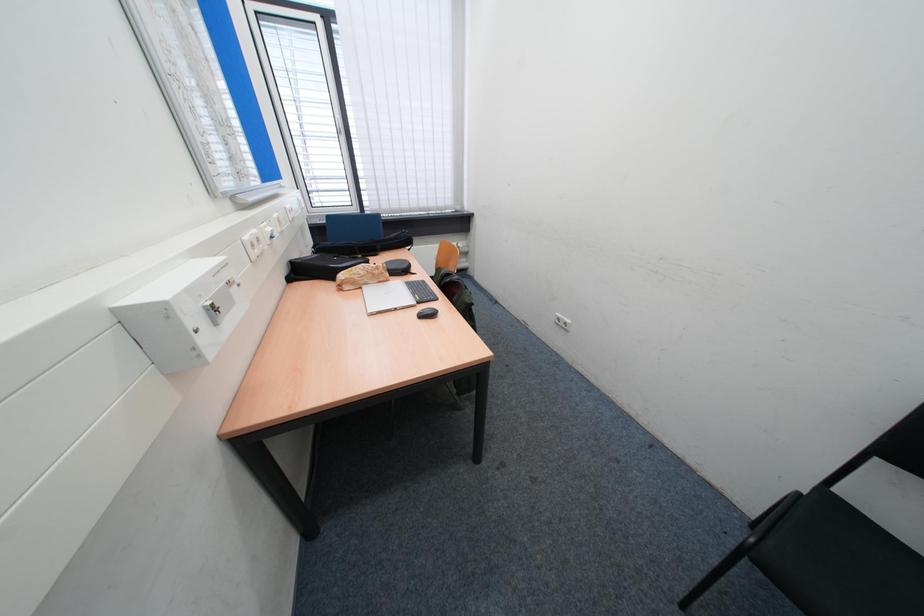
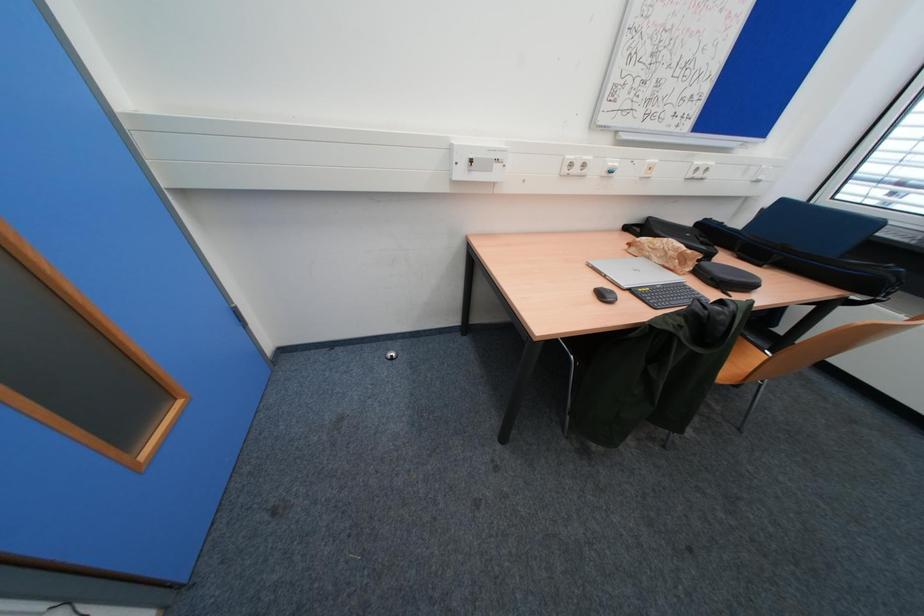
Based on the continuous images, in which direction is the camera rotating?

The camera's rotation is toward left-down.